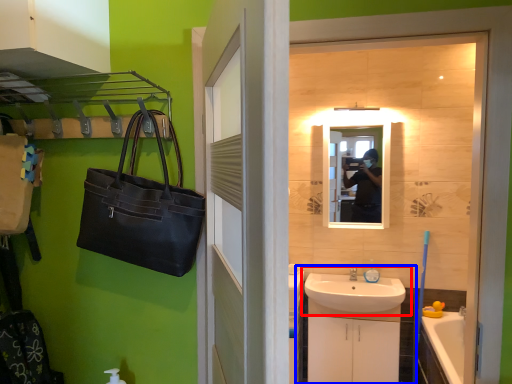
Question: Which point is closer to the camera, sink (highlighted by a red box) or bathroom cabinet (highlighted by a blue box)?

Choices:
 (A) sink
 (B) bathroom cabinet

Answer: (A)